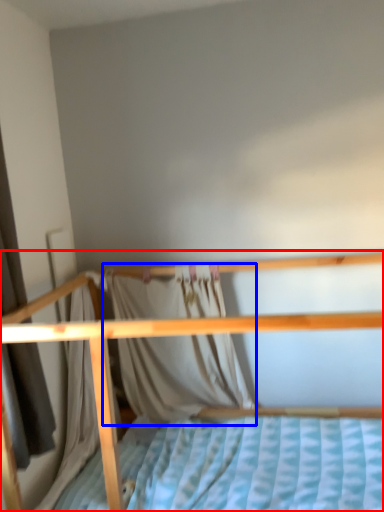
Question: Which object is further to the camera taking this photo, bed (highlighted by a red box) or curtain (highlighted by a blue box)?

Choices:
 (A) bed
 (B) curtain

Answer: (B)